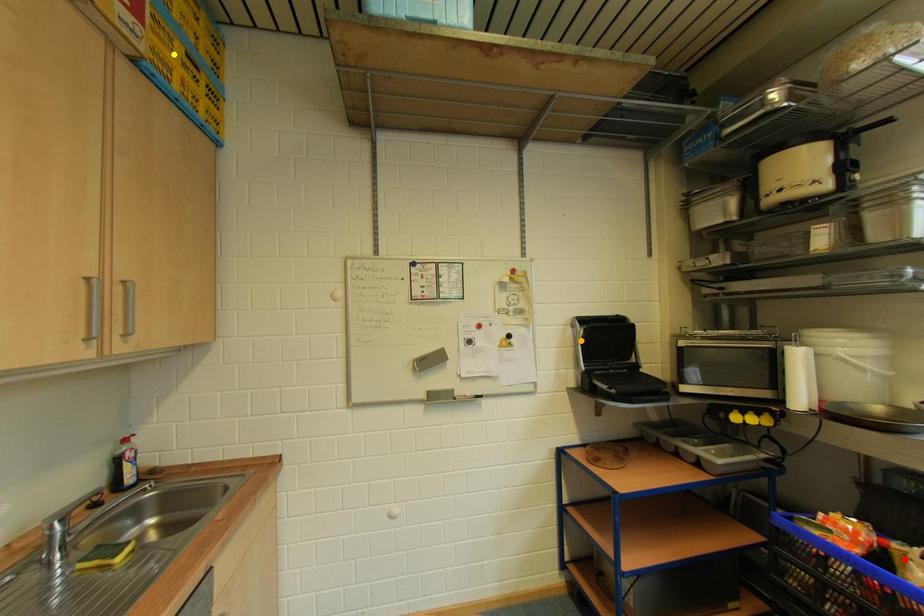
Order these from nearest to farthest:
yellow point | red point | orange point

red point < yellow point < orange point